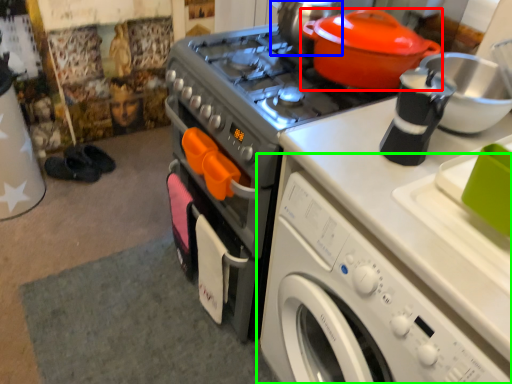
Question: Estimate the real-world distances between objects in this image. Which object is closer to kitchen appliance (highlighted by a red box), tea pot (highlighted by a blue box) or washing machine (highlighted by a green box)?

Choices:
 (A) tea pot
 (B) washing machine

Answer: (A)